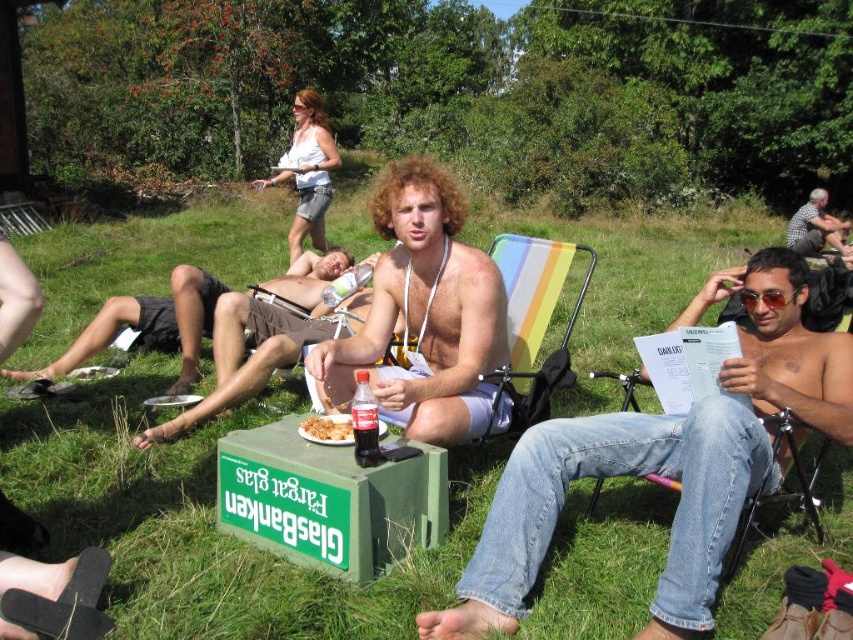
You are standing in the outdoor gathering area and want to find the white cotton blouse at upper center. Based on the green grass at center, where should you look relative to it?

The white cotton blouse at upper center is to the left of the green grass at center.

You are standing at the point with coordinates (148, 326) in the image. What object is located exactly at that point?

The brown textured shorts at center are located exactly at point (148, 326).